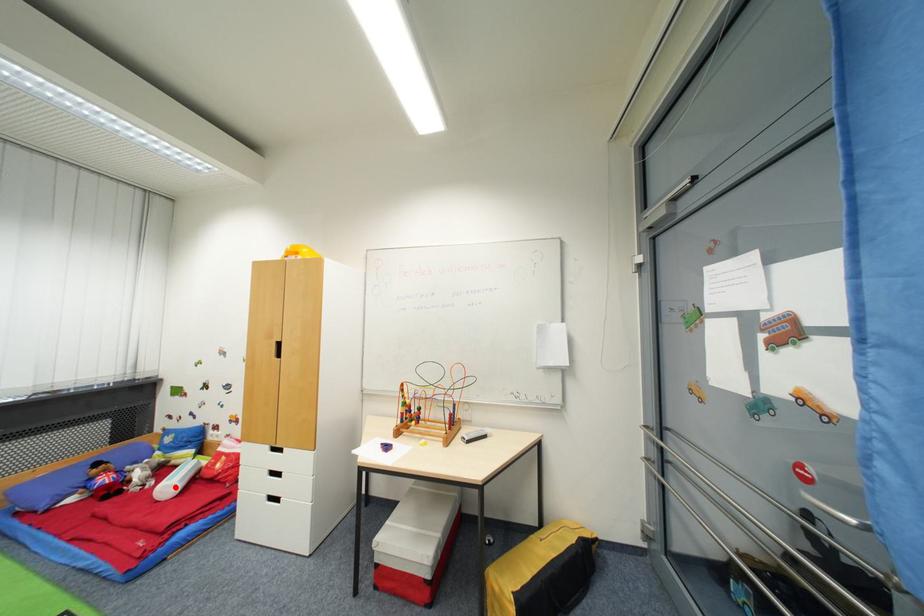
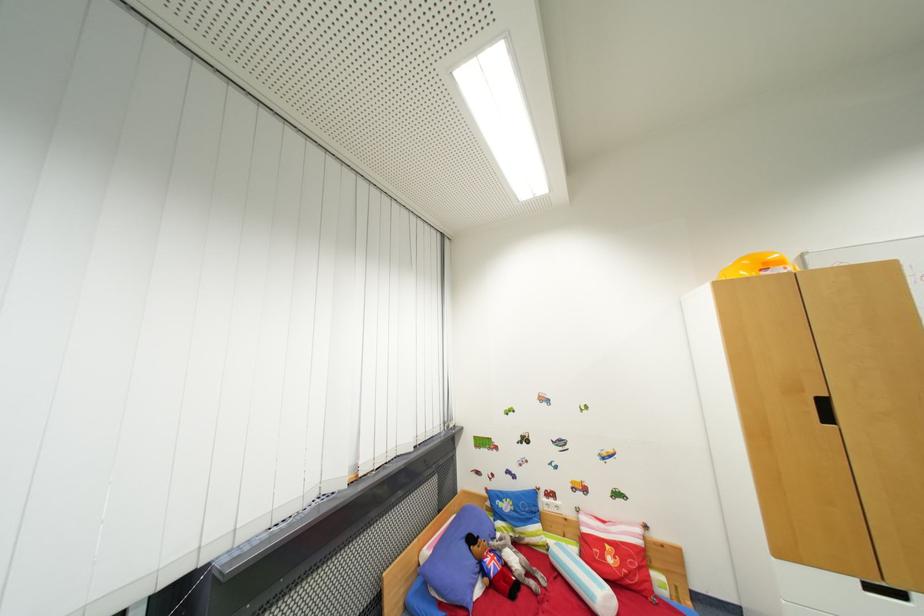
Question: I am providing you with two images of the same scene from different viewpoints. Image1 has a red point marked. In image2, the corresponding 3D location appears at what relative position? Reply with the corresponding letter.

Choices:
 (A) Closer
 (B) Farther

Answer: (B)